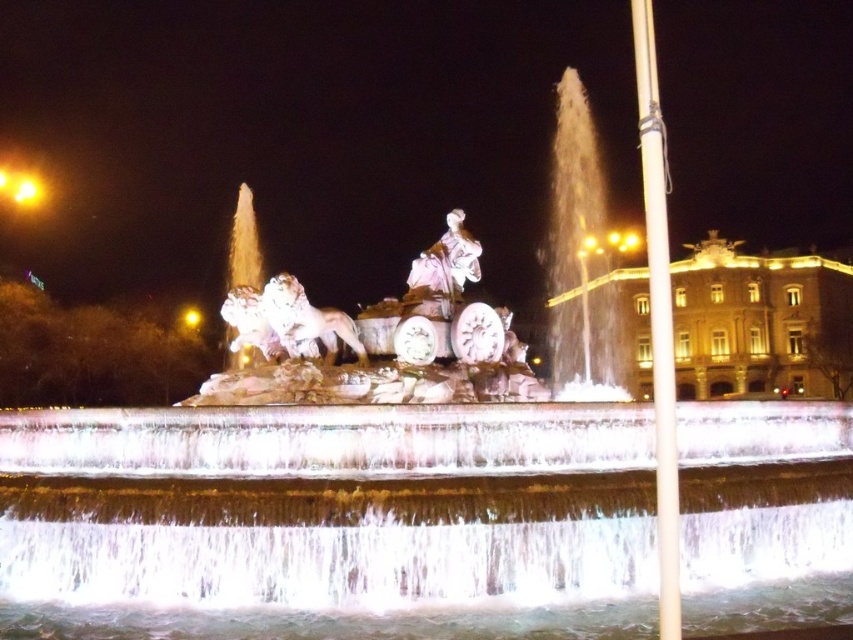
You are standing at the edge of the grand fountain and want to walk directly towards the golden stone palace at center right. As you move forward, will the clear water at center become wider or narrower in your view?

The clear water at center has a lesser width compared to golden stone palace at center right, so as you walk towards the golden stone palace at center right, the clear water at center will appear narrower in your view because it is smaller in width than the palace.

You are standing in front of the fountain and want to take a photo of both the golden stone palace at center right and the white marble statue at center. Which object should you focus on first to ensure both are in the frame?

You should focus on the white marble statue at center first because it is closer to you than the golden stone palace at center right, which is further away. By focusing on the closer object, both will be in focus as the golden stone palace at center right is behind the statue.